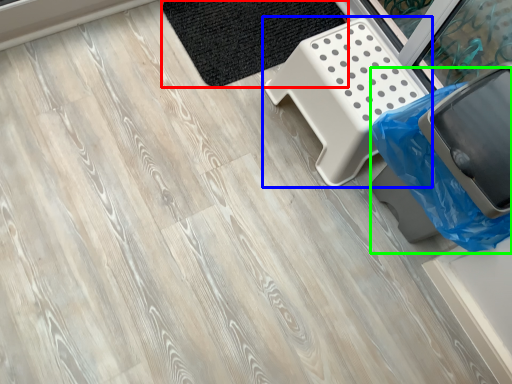
Question: Based on their relative distances, which object is farther from mat (highlighted by a red box)? Choose from furniture (highlighted by a blue box) and garbage (highlighted by a green box).

Choices:
 (A) furniture
 (B) garbage

Answer: (B)